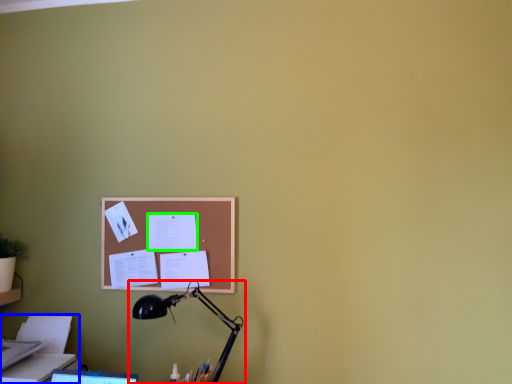
Question: Based on their relative distances, which object is farther from lamp (highlighted by a red box)? Choose from printer (highlighted by a blue box) and paper (highlighted by a green box).

Choices:
 (A) printer
 (B) paper

Answer: (A)